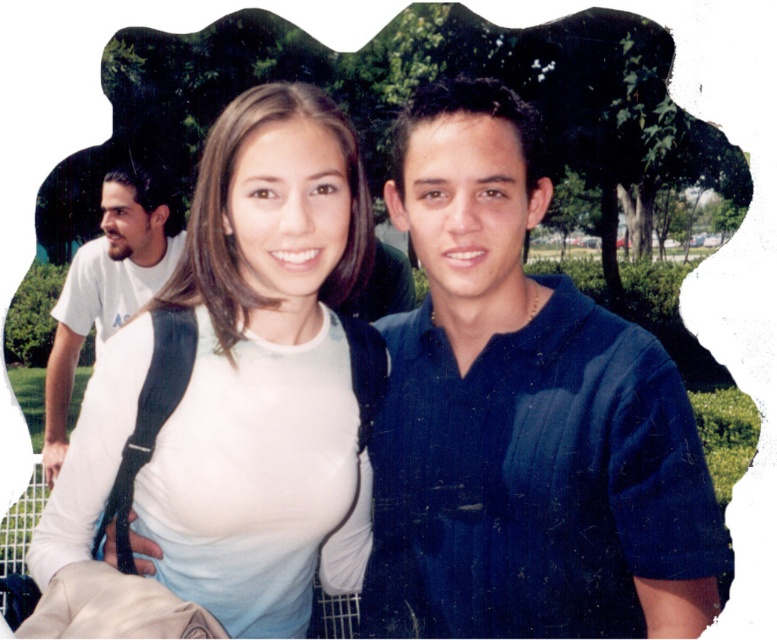
You are taking a photo of the two people in the foreground. The camera you are using has a focus point at point (204, 506). There is another focus point at point (63, 444). Which focus point is closer to the two people in the foreground?

Point (204, 506) is closer to the two people in the foreground because it is in front of point (63, 444).